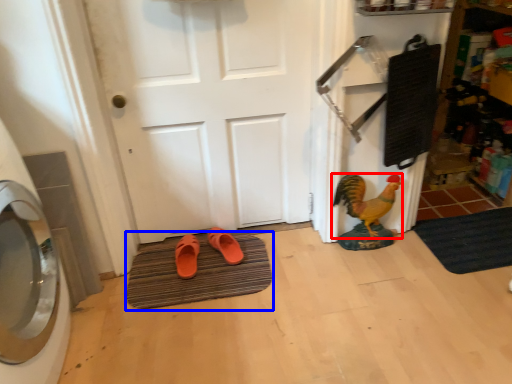
Question: Which object appears farthest to the camera in this image, chicken (highlighted by a red box) or bath mat (highlighted by a blue box)?

Choices:
 (A) chicken
 (B) bath mat

Answer: (A)